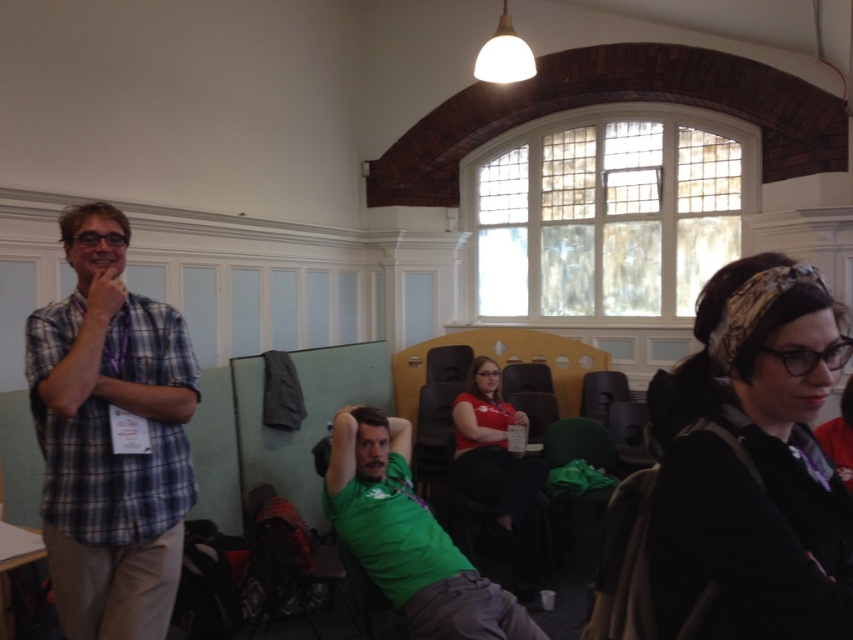
You are standing in the conference room and want to move from point A to point B. Point A is at coordinates point (840, 554) and point B is at coordinates point (358, 444). Which point is closer to you when you first enter the room?

Point (840, 554) is closer to the viewer than point (358, 444), so when you first enter the room, point A is closer to you.

You are an event planner arranging seating for a presentation. You need to ensure that the black fabric headband at upper right and the green matte shirt at center are visible to all attendees. Based on their positions, which object is higher up in the image?

The black fabric headband at upper right is above the green matte shirt at center, so it is higher up in the image.